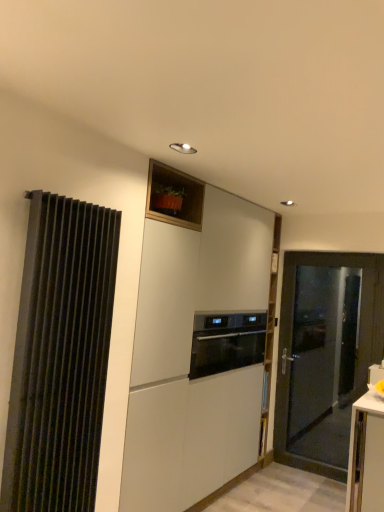
Question: From a real-world perspective, is white matte cabinet at center under matte black door at right?

Choices:
 (A) no
 (B) yes

Answer: (A)

Question: Is matte black door at right at the back of white matte cabinet at center?

Choices:
 (A) no
 (B) yes

Answer: (A)

Question: Is white matte cabinet at center not near matte black door at right?

Choices:
 (A) no
 (B) yes

Answer: (B)

Question: From the image's perspective, is white matte cabinet at center over matte black door at right?

Choices:
 (A) yes
 (B) no

Answer: (A)

Question: Is white matte cabinet at center taller than matte black door at right?

Choices:
 (A) no
 (B) yes

Answer: (B)

Question: Considering their positions, is white matte cabinet at center located in front of or behind black ribbed curtain at left?

Choices:
 (A) behind
 (B) front

Answer: (A)

Question: Considering the positions of white matte cabinet at center and black ribbed curtain at left in the image, is white matte cabinet at center wider or thinner than black ribbed curtain at left?

Choices:
 (A) wide
 (B) thin

Answer: (A)

Question: Is white matte cabinet at center to the left or to the right of black ribbed curtain at left in the image?

Choices:
 (A) left
 (B) right

Answer: (B)

Question: From their relative heights in the image, would you say white matte cabinet at center is taller or shorter than black ribbed curtain at left?

Choices:
 (A) tall
 (B) short

Answer: (A)

Question: Is black glass oven at center in front of or behind white matte cabinet at center in the image?

Choices:
 (A) behind
 (B) front

Answer: (A)

Question: Is point (259, 335) closer or farther from the camera than point (152, 210)?

Choices:
 (A) farther
 (B) closer

Answer: (A)

Question: Is black glass oven at center bigger or smaller than white matte cabinet at center?

Choices:
 (A) big
 (B) small

Answer: (B)

Question: Is black glass oven at center wider or thinner than white matte cabinet at center?

Choices:
 (A) thin
 (B) wide

Answer: (B)

Question: Would you say black ribbed curtain at left is to the left or to the right of white matte cabinet at center in the picture?

Choices:
 (A) left
 (B) right

Answer: (A)

Question: In terms of height, does black ribbed curtain at left look taller or shorter compared to white matte cabinet at center?

Choices:
 (A) tall
 (B) short

Answer: (B)